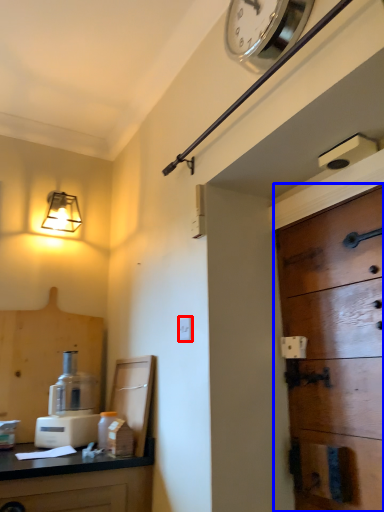
Question: Which object appears farthest to the camera in this image, light switch (highlighted by a red box) or door (highlighted by a blue box)?

Choices:
 (A) light switch
 (B) door

Answer: (A)